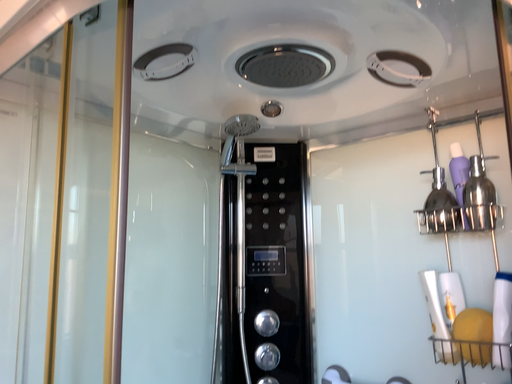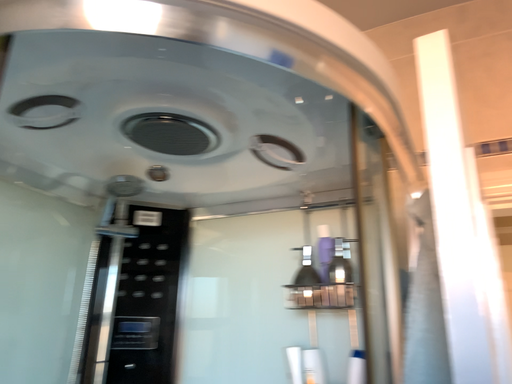
Question: How did the camera likely rotate when shooting the video?

Choices:
 (A) rotated left
 (B) rotated right

Answer: (B)